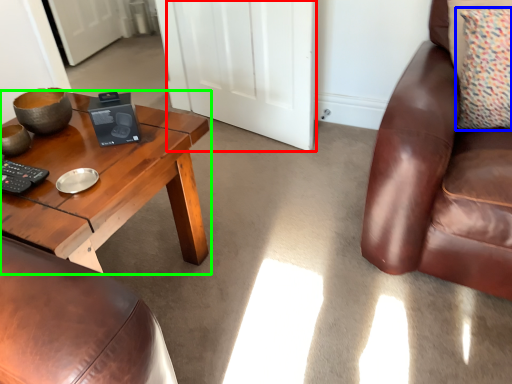
Question: Estimate the real-world distances between objects in this image. Which object is farther from door (highlighted by a red box), pillow (highlighted by a blue box) or coffee table (highlighted by a green box)?

Choices:
 (A) pillow
 (B) coffee table

Answer: (A)